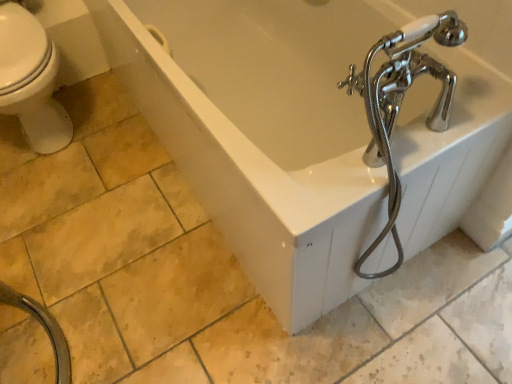
Question: From the image's perspective, is white glossy bathtub at center under black rubber garden hose at lower left?

Choices:
 (A) yes
 (B) no

Answer: (B)

Question: Considering the relative sizes of white glossy bathtub at center and black rubber garden hose at lower left in the image provided, is white glossy bathtub at center bigger than black rubber garden hose at lower left?

Choices:
 (A) yes
 (B) no

Answer: (A)

Question: Considering the relative sizes of white glossy bathtub at center and black rubber garden hose at lower left in the image provided, is white glossy bathtub at center taller than black rubber garden hose at lower left?

Choices:
 (A) no
 (B) yes

Answer: (B)

Question: From the image's perspective, would you say white glossy bathtub at center is positioned over black rubber garden hose at lower left?

Choices:
 (A) no
 (B) yes

Answer: (B)

Question: Is white glossy bathtub at center facing away from black rubber garden hose at lower left?

Choices:
 (A) yes
 (B) no

Answer: (B)

Question: Is white glossy bathtub at center outside of black rubber garden hose at lower left?

Choices:
 (A) no
 (B) yes

Answer: (B)

Question: Is black rubber garden hose at lower left bigger than white glossy bathtub at center?

Choices:
 (A) no
 (B) yes

Answer: (A)

Question: Can you confirm if black rubber garden hose at lower left is thinner than white glossy bathtub at center?

Choices:
 (A) yes
 (B) no

Answer: (A)

Question: From a real-world perspective, does black rubber garden hose at lower left sit lower than white glossy bathtub at center?

Choices:
 (A) no
 (B) yes

Answer: (B)

Question: Is there a large distance between black rubber garden hose at lower left and white glossy bathtub at center?

Choices:
 (A) yes
 (B) no

Answer: (B)

Question: Is the position of black rubber garden hose at lower left less distant than that of white glossy bathtub at center?

Choices:
 (A) yes
 (B) no

Answer: (A)

Question: Can we say black rubber garden hose at lower left lies outside white glossy bathtub at center?

Choices:
 (A) no
 (B) yes

Answer: (B)

Question: In the image, is white glossy bathtub at center on the left side or the right side of black rubber garden hose at lower left?

Choices:
 (A) left
 (B) right

Answer: (B)